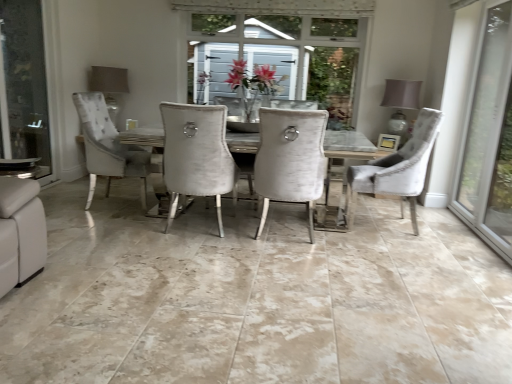
Question: From a real-world perspective, does clear glass screen door at left stand above velvet grey chair at right, the 1th chair in the right-to-left sequence?

Choices:
 (A) no
 (B) yes

Answer: (B)

Question: Does clear glass screen door at left have a lesser width compared to velvet grey chair at right, which appears as the second chair when viewed from the left?

Choices:
 (A) no
 (B) yes

Answer: (B)

Question: Could you tell me if clear glass screen door at left is facing velvet grey chair at right, which appears as the second chair when viewed from the left?

Choices:
 (A) no
 (B) yes

Answer: (B)

Question: From the image's perspective, is clear glass screen door at left beneath velvet grey chair at right, the 1th chair in the right-to-left sequence?

Choices:
 (A) no
 (B) yes

Answer: (A)

Question: Does clear glass screen door at left have a lesser height compared to velvet grey chair at right, the 1th chair in the right-to-left sequence?

Choices:
 (A) no
 (B) yes

Answer: (A)

Question: Based on their sizes in the image, would you say matte gray lampshade at upper left, marked as the 2th lamp in a right-to-left arrangement, is bigger or smaller than velvet grey chair at right, which appears as the second chair when viewed from the left?

Choices:
 (A) big
 (B) small

Answer: (B)

Question: From the image's perspective, is matte gray lampshade at upper left, marked as the 2th lamp in a right-to-left arrangement, above or below velvet grey chair at right, which appears as the second chair when viewed from the left?

Choices:
 (A) below
 (B) above

Answer: (B)

Question: Is matte gray lampshade at upper left, which is counted as the 1th lamp, starting from the left, in front of or behind velvet grey chair at right, which appears as the second chair when viewed from the left, in the image?

Choices:
 (A) behind
 (B) front

Answer: (A)

Question: Is point (117, 86) closer or farther from the camera than point (393, 178)?

Choices:
 (A) farther
 (B) closer

Answer: (A)

Question: From the image's perspective, is velvet grey chair at right, the 1th chair in the right-to-left sequence, above or below transparent glass door at right?

Choices:
 (A) above
 (B) below

Answer: (B)

Question: From a real-world perspective, is velvet grey chair at right, the 1th chair in the right-to-left sequence, positioned above or below transparent glass door at right?

Choices:
 (A) above
 (B) below

Answer: (B)

Question: From their relative heights in the image, would you say velvet grey chair at right, the 1th chair in the right-to-left sequence, is taller or shorter than transparent glass door at right?

Choices:
 (A) tall
 (B) short

Answer: (B)

Question: Looking at their shapes, would you say velvet grey chair at right, the 1th chair in the right-to-left sequence, is wider or thinner than transparent glass door at right?

Choices:
 (A) wide
 (B) thin

Answer: (A)

Question: Considering the positions of point (478, 84) and point (100, 69), is point (478, 84) closer or farther from the camera than point (100, 69)?

Choices:
 (A) closer
 (B) farther

Answer: (A)

Question: Considering the positions of transparent glass door at right and matte gray lampshade at upper left, which is counted as the 1th lamp, starting from the left, in the image, is transparent glass door at right taller or shorter than matte gray lampshade at upper left, which is counted as the 1th lamp, starting from the left,?

Choices:
 (A) tall
 (B) short

Answer: (A)